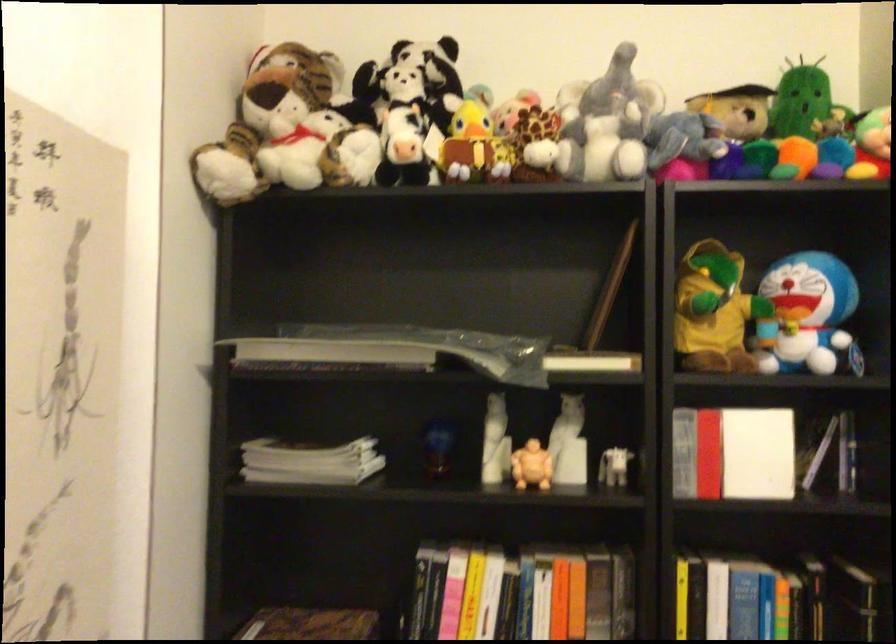
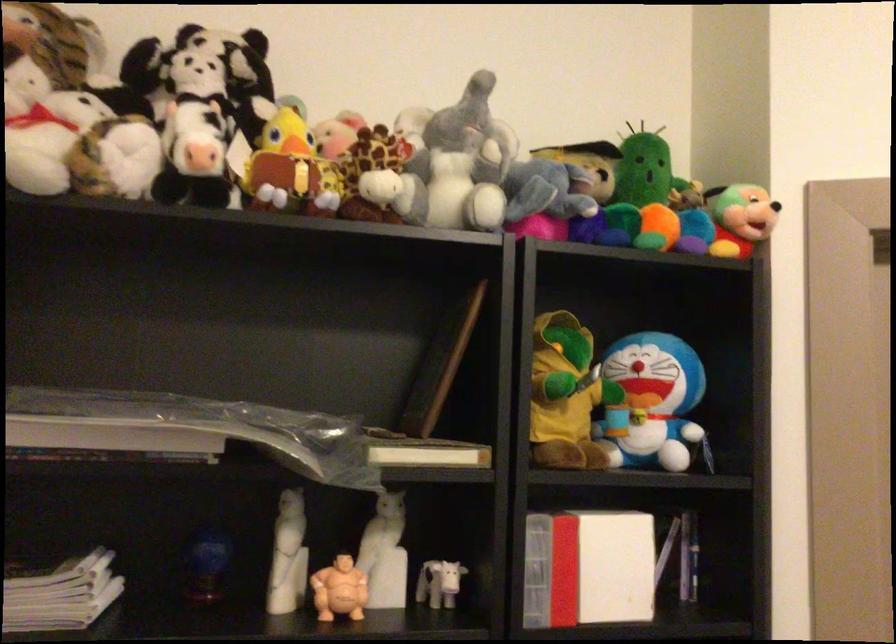
Locate, in the second image, the point that corresponds to the point at 567,442 in the first image.

(384, 554)